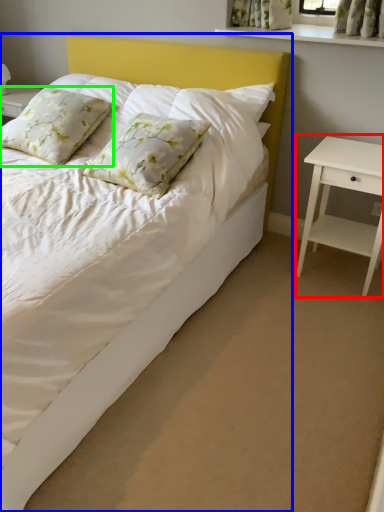
Question: Based on their relative distances, which object is nearer to nightstand (highlighted by a red box)? Choose from bed (highlighted by a blue box) and pillow (highlighted by a green box).

Choices:
 (A) bed
 (B) pillow

Answer: (A)